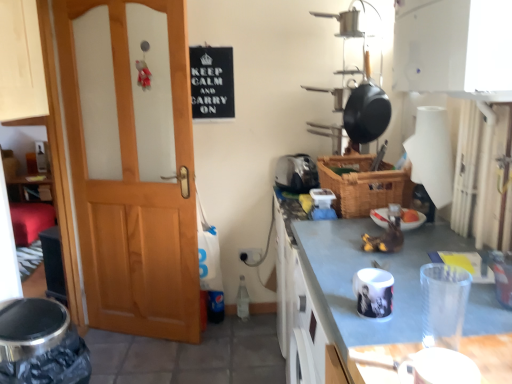
Identify the location of vacant area situated below wooden door at left (from a real-world perspective). This screenshot has height=384, width=512. (140, 329).